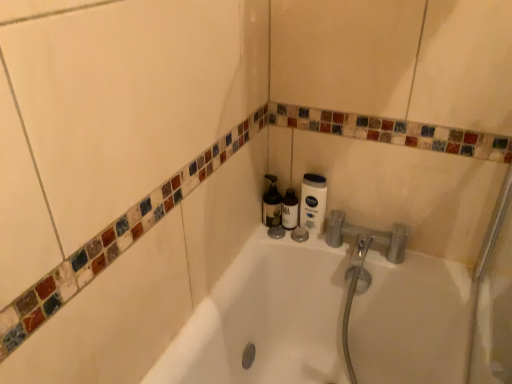
Question: Is translucent plastic bottle at center closer to the viewer compared to white matte lotion at upper right?

Choices:
 (A) yes
 (B) no

Answer: (B)

Question: Is white matte lotion at upper right at the back of translucent plastic bottle at center?

Choices:
 (A) yes
 (B) no

Answer: (B)

Question: Can you confirm if translucent plastic bottle at center is positioned to the right of white matte lotion at upper right?

Choices:
 (A) no
 (B) yes

Answer: (A)

Question: From the image's perspective, is translucent plastic bottle at center beneath white matte lotion at upper right?

Choices:
 (A) yes
 (B) no

Answer: (B)

Question: Does translucent plastic bottle at center have a lesser width compared to white matte lotion at upper right?

Choices:
 (A) no
 (B) yes

Answer: (A)

Question: Is translucent plastic bottle at center touching white matte lotion at upper right?

Choices:
 (A) yes
 (B) no

Answer: (B)

Question: Can you confirm if white matte lotion at upper right is taller than matte black bottle at center?

Choices:
 (A) no
 (B) yes

Answer: (B)

Question: From a real-world perspective, is white matte lotion at upper right positioned over matte black bottle at center based on gravity?

Choices:
 (A) no
 (B) yes

Answer: (B)

Question: From the image's perspective, is white matte lotion at upper right on matte black bottle at center?

Choices:
 (A) yes
 (B) no

Answer: (A)

Question: Is white matte lotion at upper right oriented away from matte black bottle at center?

Choices:
 (A) no
 (B) yes

Answer: (A)

Question: Is white matte lotion at upper right not within matte black bottle at center?

Choices:
 (A) yes
 (B) no

Answer: (A)

Question: Is matte black bottle at center a part of white matte lotion at upper right?

Choices:
 (A) no
 (B) yes

Answer: (A)

Question: From the image's perspective, is matte black bottle at center located above white matte lotion at upper right?

Choices:
 (A) no
 (B) yes

Answer: (A)